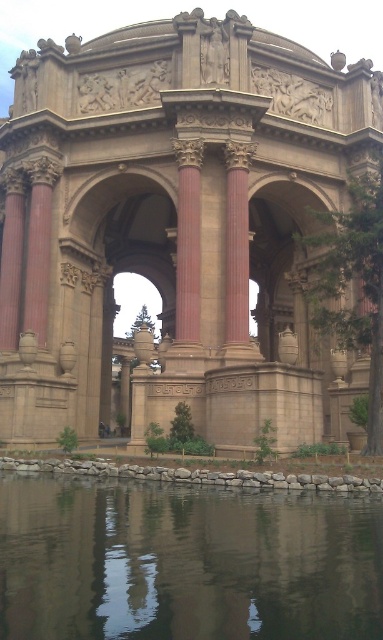
You are an architect visiting the Palace of Fine Arts. You notice the beige stone palace at center and the transparent glass water at lower center. Which object in the scene is bigger in size?

The beige stone palace at center is larger in size compared to the transparent glass water at lower center.

Based on the photo, you are standing at the entrance of the Palace of Fine Arts in San Francisco. You want to take a photo of the beige stone palace at center. Where should you position yourself to capture the palace in the center of your camera frame?

To capture the beige stone palace at center in the center of your camera frame, you should position yourself directly in front of the palace at point (x=176, y=225) as specified in the coordinates.